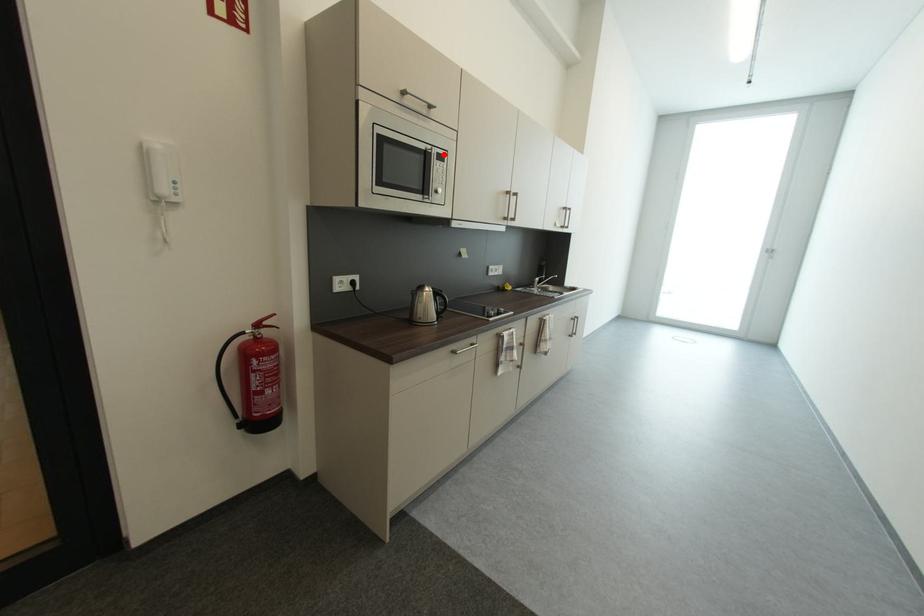
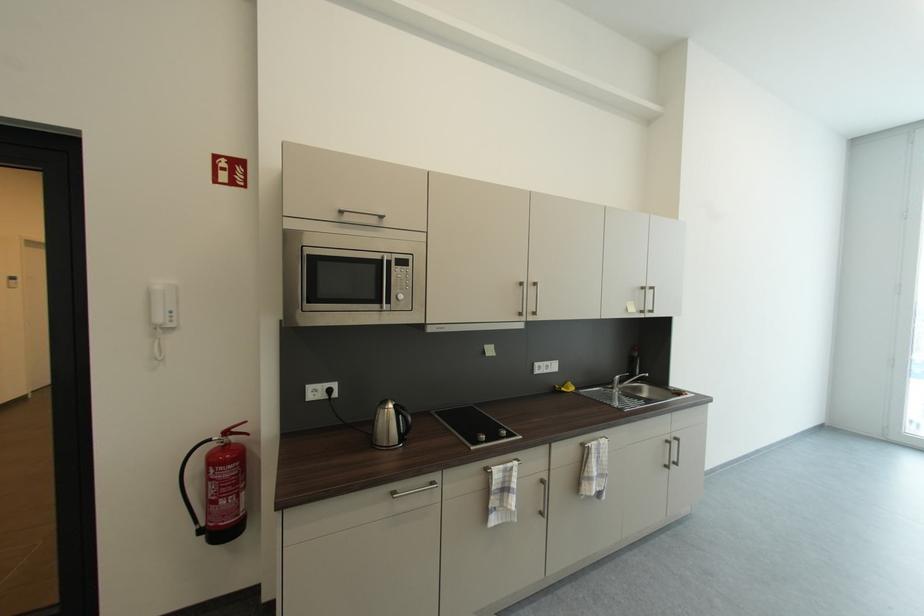
Where in the second image is the point corresponding to the highlighted location from the first image?

(403, 261)